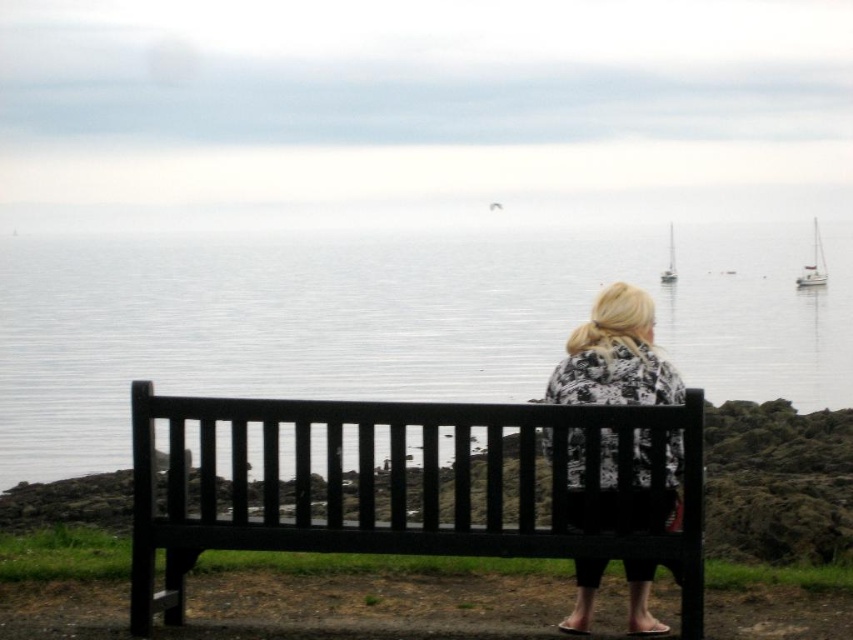
Question: Does white glossy sailboat at right have a larger size compared to white glossy sailboat at upper center?

Choices:
 (A) yes
 (B) no

Answer: (A)

Question: Which point is farther from the camera taking this photo?

Choices:
 (A) 816,250
 (B) 653,353
 (C) 669,243

Answer: (C)

Question: Among these objects, which one is nearest to the camera?

Choices:
 (A) black wood bench at center
 (B) smooth water at center

Answer: (A)

Question: Is smooth water at center to the left of white glossy sailboat at right from the viewer's perspective?

Choices:
 (A) no
 (B) yes

Answer: (B)

Question: Which of the following is the farthest from the observer?

Choices:
 (A) tap(672, 257)
 (B) tap(328, 550)

Answer: (A)

Question: Can you confirm if white glossy sailboat at right is thinner than white glossy sailboat at upper center?

Choices:
 (A) no
 (B) yes

Answer: (A)